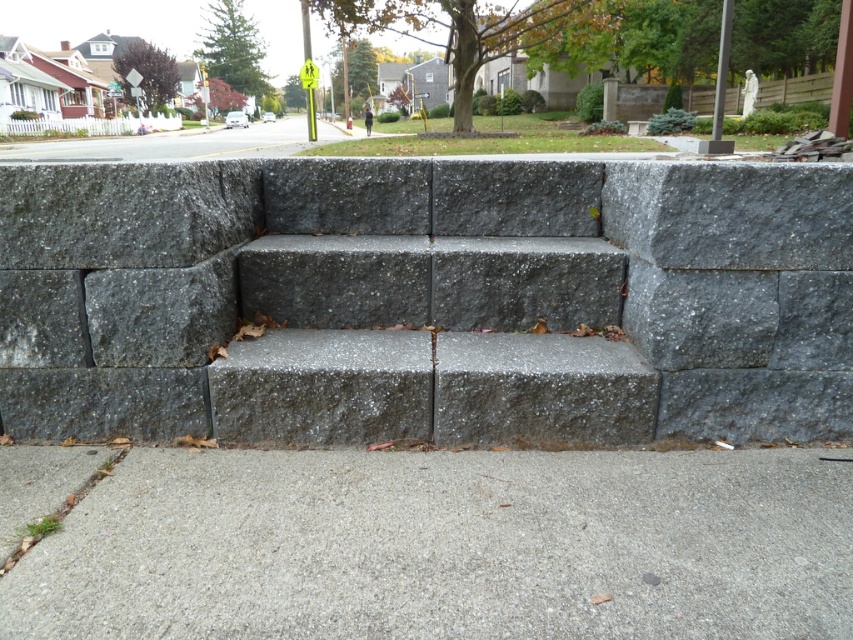
Based on the photo, you are a delivery person carrying a heavy package and need to walk up the gray concrete stairs at center. Is the gray concrete pavement at lower center located below the stairs?

Yes, the gray concrete pavement at lower center is located below the gray concrete stairs at center, so you can safely place your feet on the pavement while ascending the stairs.

You are standing on the gray concrete pavement at lower center and want to walk up the gray concrete stairs at center. In which direction should you move to reach the stairs?

You should move to the right because the gray concrete stairs at center are located to the left of the gray concrete pavement at lower center, so moving right from the pavement will lead you towards the stairs.

You are a delivery person with a cart that is 30 inches wide. You need to move from the gray concrete pavement at lower center to the gray concrete stairs at center. Is there enough space between them for your cart to pass through?

The gray concrete stairs at center and gray concrete pavement at lower center are 25.89 inches apart, which is narrower than the cart width of 30 inches. Therefore, the cart cannot pass through the space between them.